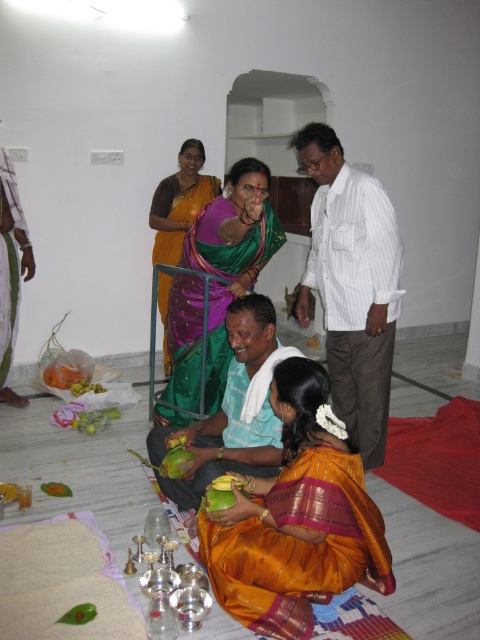
You are a photographer at this ceremony and need to capture both the golden silk saree at center and the yellow matte coconut at lower left in the same frame. Based on their sizes, which object should you focus on first to ensure both fit properly?

The golden silk saree at center is taller than the yellow matte coconut at lower left, so you should focus on positioning the camera to accommodate the taller golden silk saree at center first to ensure both fit in the frame.

You are a photographer capturing this ceremony. You notice two silk sarees at the center of the image. Which one would appear larger in your photo, the golden silk saree at center or the green silk saree at center?

The golden silk saree at center appears larger in the photo because it is closer to the viewer than the green silk saree at center.